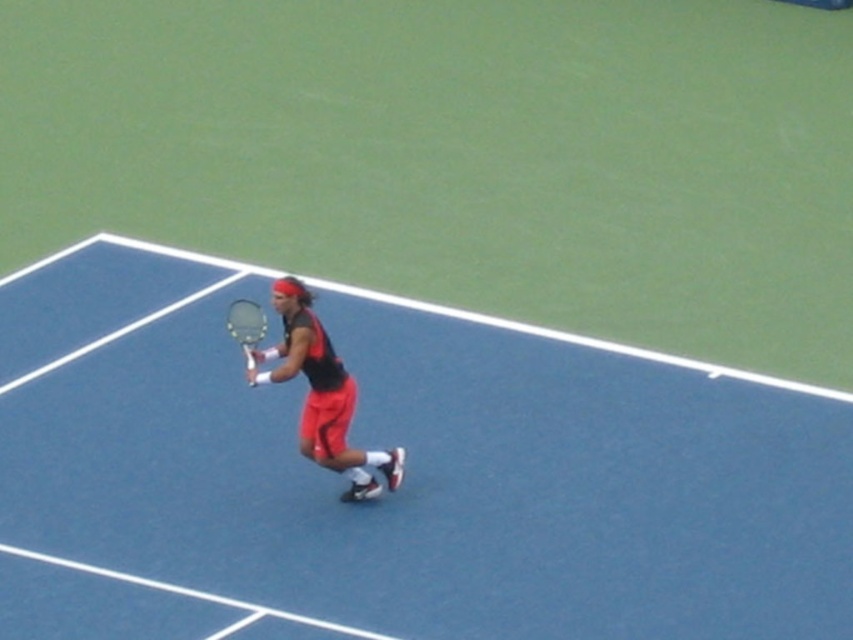
Question: Based on their relative distances, which object is farther from the white glossy tennis racket at center?

Choices:
 (A) matte black tennis racket at center
 (B) blue rubber tennis court at center

Answer: (B)

Question: Is matte black tennis racket at center further to the viewer compared to white glossy tennis racket at center?

Choices:
 (A) yes
 (B) no

Answer: (A)

Question: Is blue rubber tennis court at center closer to camera compared to white glossy tennis racket at center?

Choices:
 (A) no
 (B) yes

Answer: (B)

Question: Which object is the farthest from the matte black tennis racket at center?

Choices:
 (A) white glossy tennis racket at center
 (B) blue rubber tennis court at center

Answer: (B)

Question: Considering the relative positions of matte black tennis racket at center and white glossy tennis racket at center in the image provided, where is matte black tennis racket at center located with respect to white glossy tennis racket at center?

Choices:
 (A) right
 (B) left

Answer: (A)

Question: Which of the following is the closest to the observer?

Choices:
 (A) (386, 464)
 (B) (251, 304)

Answer: (B)